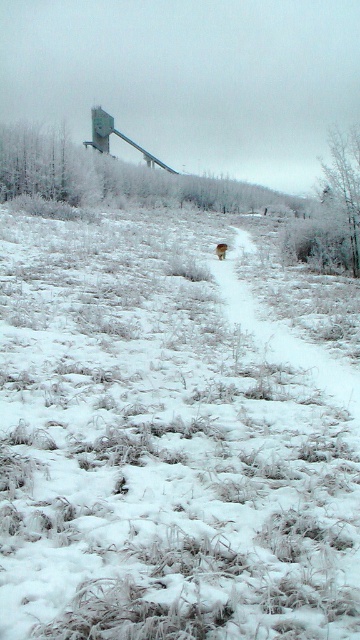
Between white fluffy snow at center and brown furry dog at center, which one has more height?

white fluffy snow at center

Between white fluffy snow at center and brown furry dog at center, which one appears on the left side from the viewer's perspective?

white fluffy snow at center

Is point (47, 632) behind point (216, 248)?

No, it is in front of (216, 248).

In order to click on white fluffy snow at center in this screenshot , I will do `click(159, 449)`.